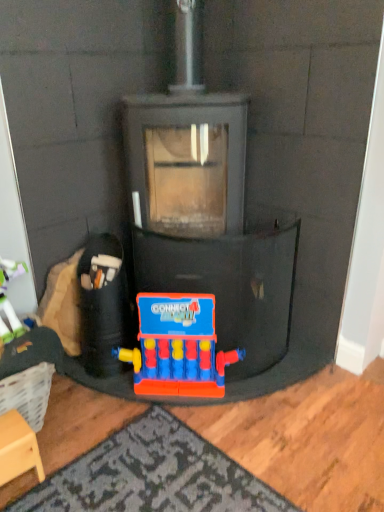
Question: Is wooden stool at lower left not near rubberized plastic toy at lower center, the second toy from the right?

Choices:
 (A) yes
 (B) no

Answer: (B)

Question: Is wooden stool at lower left positioned beyond the bounds of rubberized plastic toy at lower center, the second toy from the right?

Choices:
 (A) no
 (B) yes

Answer: (B)

Question: Does wooden stool at lower left appear on the right side of rubberized plastic toy at lower center, the second toy from the right?

Choices:
 (A) yes
 (B) no

Answer: (B)

Question: Can you confirm if wooden stool at lower left is wider than rubberized plastic toy at lower center, the second toy from the right?

Choices:
 (A) no
 (B) yes

Answer: (A)

Question: Does wooden stool at lower left lie behind rubberized plastic toy at lower center, the second toy from the right?

Choices:
 (A) no
 (B) yes

Answer: (A)

Question: Could you tell me if wooden stool at lower left is turned towards rubberized plastic toy at lower center, acting as the first toy starting from the left?

Choices:
 (A) yes
 (B) no

Answer: (B)

Question: Considering the relative positions of plastic connect four game at center, the 1th toy when ordered from right to left, and wooden stool at lower left in the image provided, is plastic connect four game at center, the 1th toy when ordered from right to left, to the left of wooden stool at lower left from the viewer's perspective?

Choices:
 (A) yes
 (B) no

Answer: (B)

Question: Considering the relative positions of plastic connect four game at center, the 1th toy when ordered from right to left, and wooden stool at lower left in the image provided, is plastic connect four game at center, the 1th toy when ordered from right to left, to the right of wooden stool at lower left from the viewer's perspective?

Choices:
 (A) yes
 (B) no

Answer: (A)

Question: Is wooden stool at lower left inside plastic connect four game at center, the 1th toy when ordered from right to left?

Choices:
 (A) no
 (B) yes

Answer: (A)

Question: Can you confirm if plastic connect four game at center, the 1th toy when ordered from right to left, is taller than wooden stool at lower left?

Choices:
 (A) no
 (B) yes

Answer: (B)

Question: Can you confirm if plastic connect four game at center, the 2th toy when ordered from left to right, is bigger than wooden stool at lower left?

Choices:
 (A) no
 (B) yes

Answer: (B)

Question: Is plastic connect four game at center, the 2th toy when ordered from left to right, touching wooden stool at lower left?

Choices:
 (A) no
 (B) yes

Answer: (A)

Question: Could you tell me if plastic connect four game at center, the 2th toy when ordered from left to right, is facing rubberized plastic toy at lower center, acting as the first toy starting from the left?

Choices:
 (A) no
 (B) yes

Answer: (A)